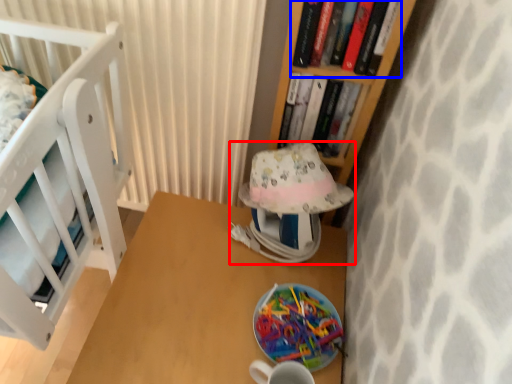
Question: Among these objects, which one is nearest to the camera, table lamp (highlighted by a red box) or book (highlighted by a blue box)?

Choices:
 (A) table lamp
 (B) book

Answer: (B)